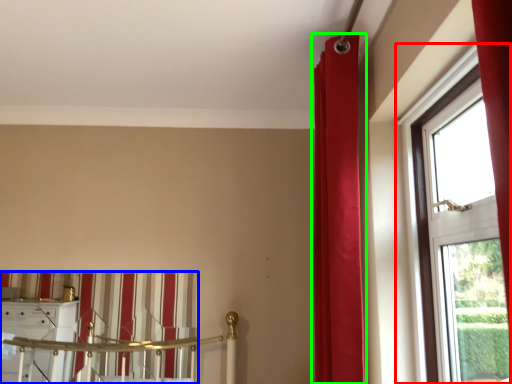
Question: Which object is positioned closest to window (highlighted by a red box)? Select from curtain (highlighted by a blue box) and curtain (highlighted by a green box).

Choices:
 (A) curtain
 (B) curtain

Answer: (B)